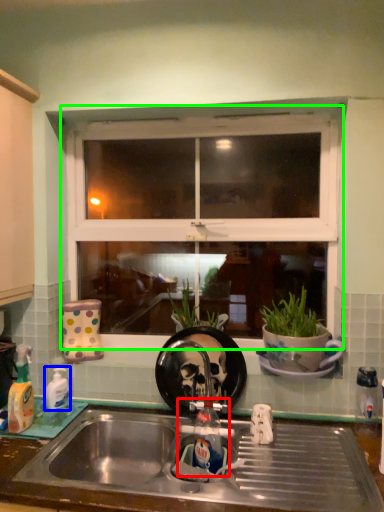
Question: Which object is positioned farthest from tap (highlighted by a red box)? Select from bottle (highlighted by a blue box) and window (highlighted by a green box).

Choices:
 (A) bottle
 (B) window

Answer: (B)